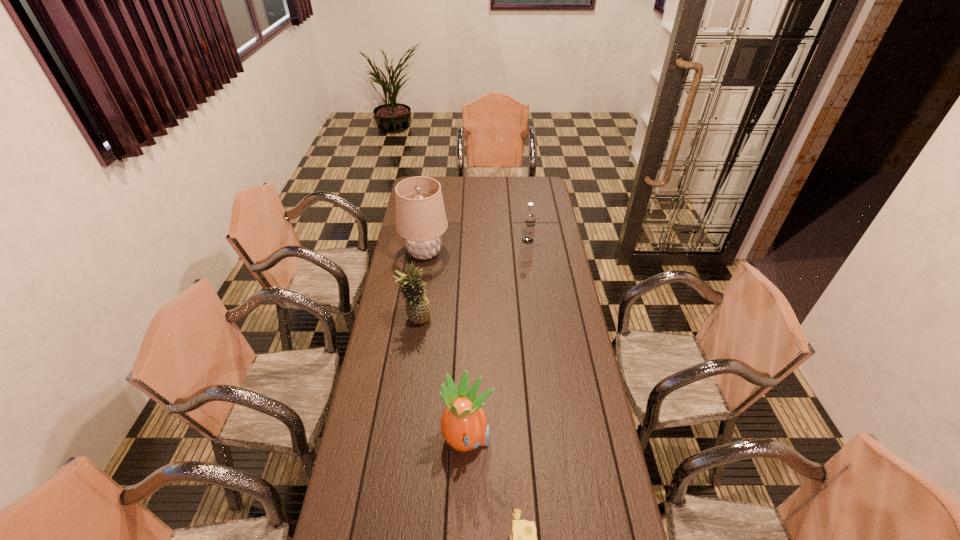
Find the location of a particular element. lampshade is located at coordinates (420, 213).

Locate an element on the screen. Image resolution: width=960 pixels, height=540 pixels. the left pineapple is located at coordinates (418, 310).

Find the location of a particular element. The height and width of the screenshot is (540, 960). the third nearest object is located at coordinates (418, 310).

In order to click on the second nearest object in this screenshot , I will do `click(464, 426)`.

In order to click on the third object from left to right in this screenshot , I will do `click(464, 426)`.

Where is `the rightmost object`? This screenshot has height=540, width=960. the rightmost object is located at coordinates (529, 217).

Where is `vacant point located 0.170m on the right of the tallest object`? The image size is (960, 540). vacant point located 0.170m on the right of the tallest object is located at coordinates (481, 253).

This screenshot has height=540, width=960. Find the location of `vacant space located on the back of the farther pineapple`. vacant space located on the back of the farther pineapple is located at coordinates (421, 280).

Where is `vacant space located at the entrance of the third object from right to left`? The width and height of the screenshot is (960, 540). vacant space located at the entrance of the third object from right to left is located at coordinates (606, 440).

The width and height of the screenshot is (960, 540). I want to click on free spot located on the front label of the rightmost object, so click(532, 273).